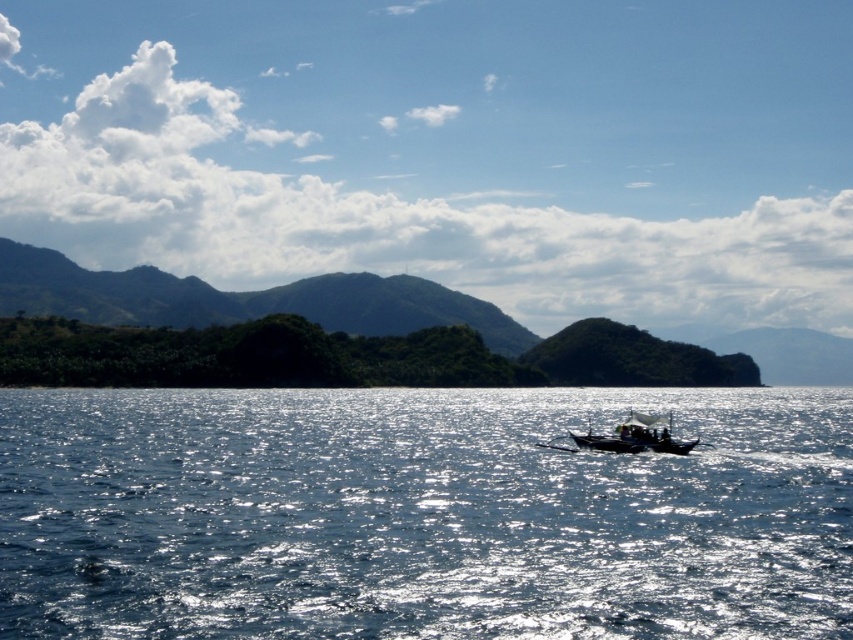
Question: Which point is farther to the camera?

Choices:
 (A) glistening blue water at center
 (B) green leafy mountain at left
 (C) black wooden boat at center

Answer: (B)

Question: Based on their relative distances, which object is farther from the green leafy mountain at left?

Choices:
 (A) glistening blue water at center
 (B) black wooden boat at center

Answer: (B)

Question: Which point is farther to the camera?

Choices:
 (A) black wooden boat at center
 (B) glistening blue water at center
 (C) green leafy mountain at left

Answer: (C)

Question: Is green leafy mountain at left further to the viewer compared to black wooden boat at center?

Choices:
 (A) no
 (B) yes

Answer: (B)

Question: From the image, what is the correct spatial relationship of green leafy mountain at left in relation to black wooden boat at center?

Choices:
 (A) below
 (B) above

Answer: (B)

Question: Does green leafy mountain at left have a larger size compared to black wooden boat at center?

Choices:
 (A) yes
 (B) no

Answer: (A)